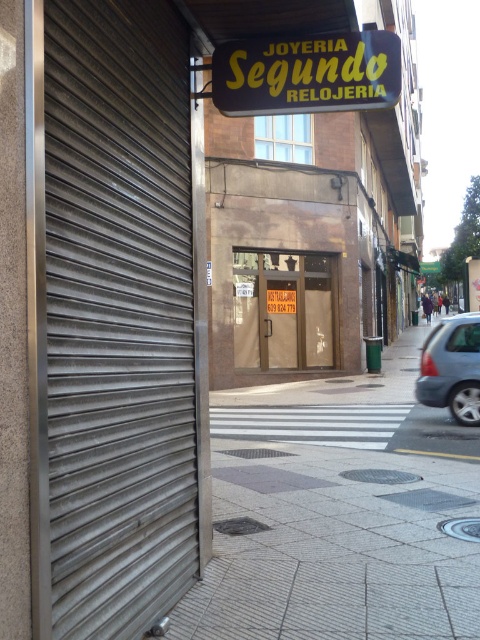
Measure the distance between point (113,410) and camera.

Point (113,410) and camera are 8.73 feet apart.

Which is behind, point (179, 444) or point (435, 372)?

Positioned behind is point (435, 372).

Measure the distance between point (x=136, y=602) and camera.

The distance of point (x=136, y=602) from camera is 9.31 feet.

Locate an element on the screen. metallic gray garage door at left is located at coordinates (119, 316).

Can you confirm if yellow plastic sign at upper center is taller than silver metallic car at right?

No, yellow plastic sign at upper center is not taller than silver metallic car at right.

Measure the distance between yellow plastic sign at upper center and camera.

yellow plastic sign at upper center is 11.93 feet from camera.

Which is in front, point (276, 49) or point (450, 378)?

Positioned in front is point (276, 49).

Locate an element on the screen. This screenshot has width=480, height=640. yellow plastic sign at upper center is located at coordinates (307, 74).

Does metallic gray garage door at left have a greater height compared to brown matte door at center?

Correct, metallic gray garage door at left is much taller as brown matte door at center.

Does metallic gray garage door at left have a lesser width compared to brown matte door at center?

Yes.

At what (x,y) coordinates should I click in order to perform the action: click on metallic gray garage door at left. Please return your answer as a coordinate pair (x, y). This screenshot has height=640, width=480. Looking at the image, I should click on (119, 316).